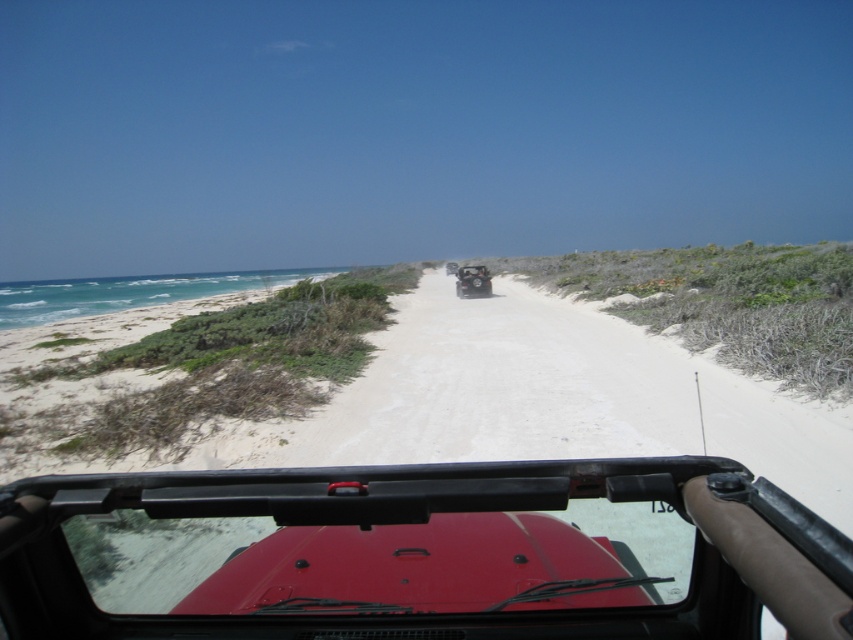
You are driving a matte red car at center and want to pass a matte black jeep at center ahead on the same sandy road. Can you safely pass the jeep without moving off the road?

The matte red car at center is closer to the viewer than the matte black jeep at center, so you are already ahead of the matte black jeep at center. You don not need to pass it.

You are a passenger in the Jeep and want to point out a specific location on the vehicle. The coordinates given are point (x=473, y=282). Where exactly on the matte red jeep at center would this point be located?

The point (x=473, y=282) is located on the matte red jeep at center.

You are driving a Jeep on a sandy road and need to navigate around two points ahead. The points are labeled as point (486, 292) and point (447, 260). Which point is closer to your current position inside the Jeep?

Point (486, 292) is closer to the viewer than point (447, 260), so the point (486, 292) is closer to your current position inside the Jeep.